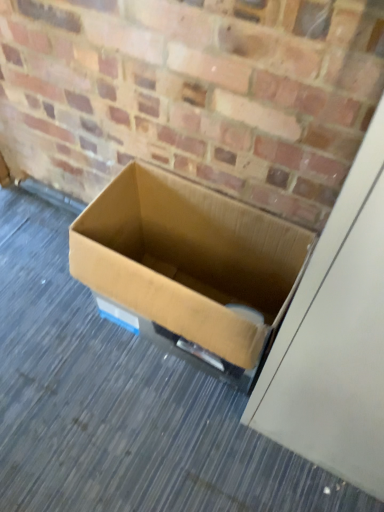
Where is `free space in front of brown cardboard box at center`? Image resolution: width=384 pixels, height=512 pixels. free space in front of brown cardboard box at center is located at coordinates (168, 440).